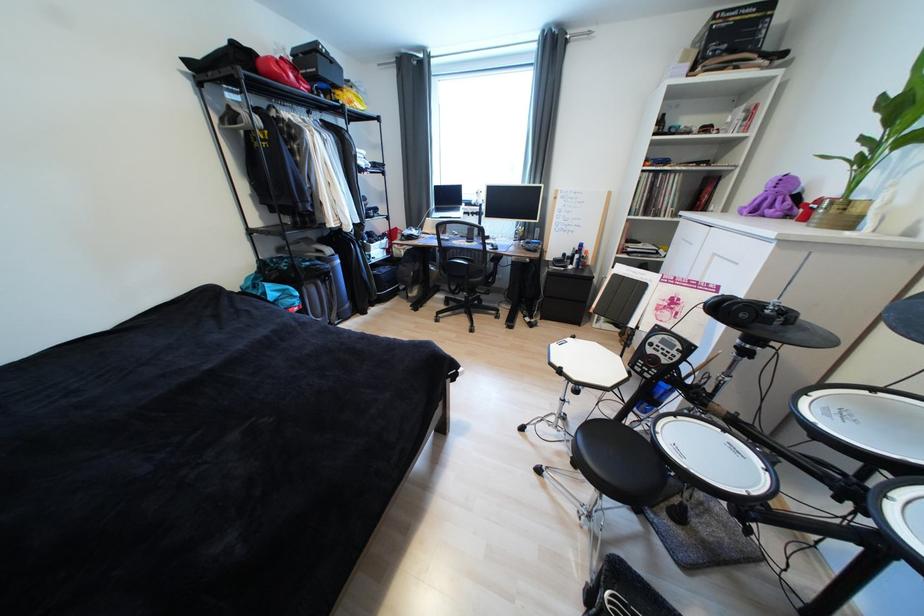
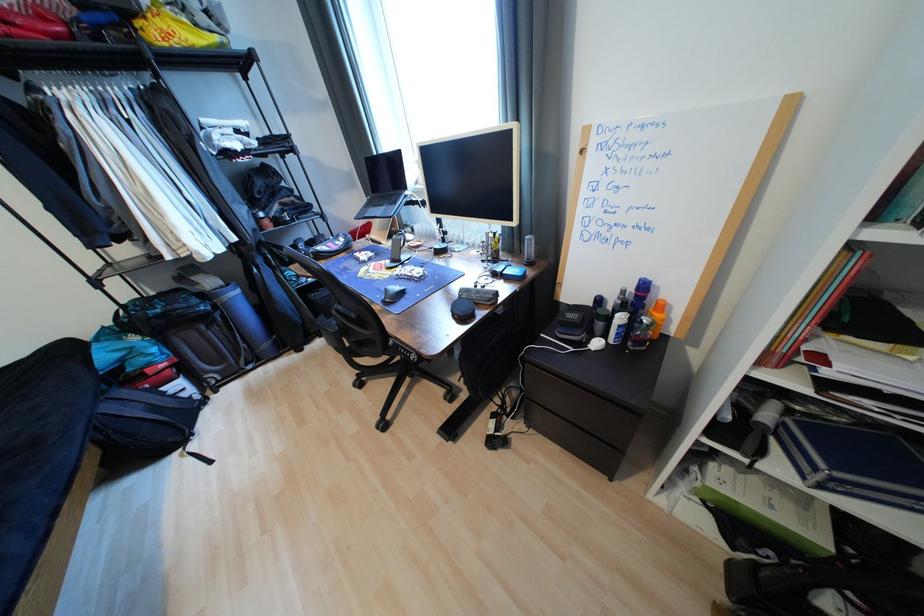
Question: I am providing you with two images of the same scene from different viewpoints. After the viewpoint changes to image2, which objects are now occluded?

Choices:
 (A) orange cap bottle
 (B) blue cap spray can
 (C) black computer mouse
 (D) none of these

Answer: (D)